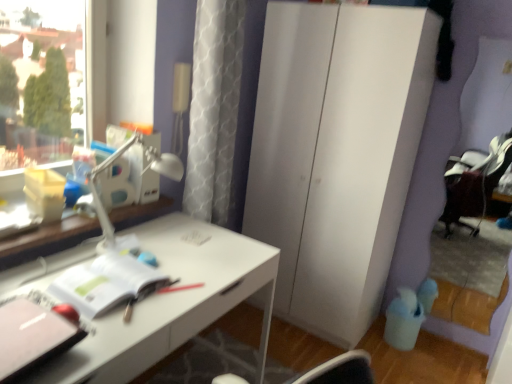
Locate an element on the screen. vacant area that lies to the right of white matte notebook at center, the 1th notebook when ordered from back to front is located at coordinates (182, 289).